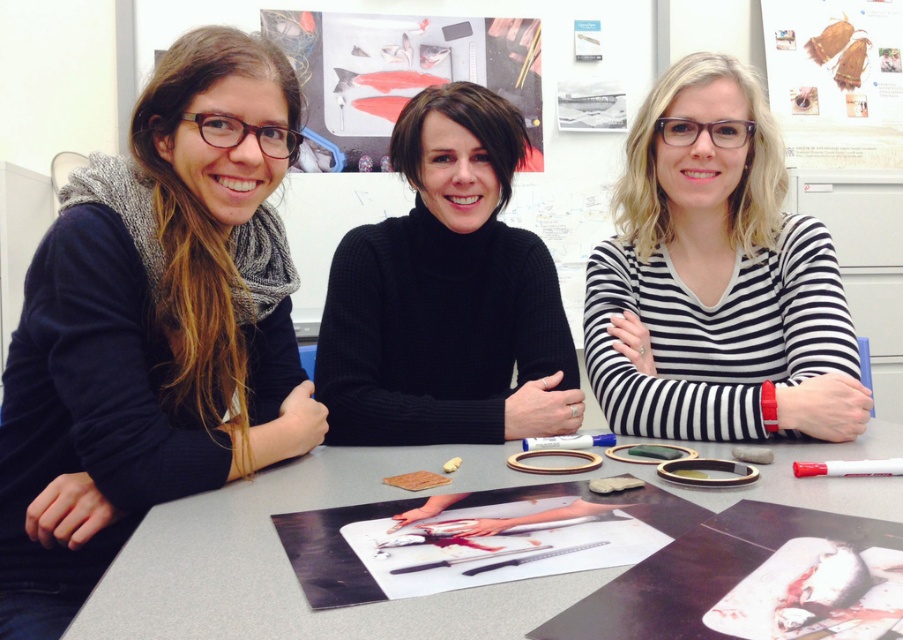
Question: Does matte black sweater at left have a smaller size compared to smooth gray table at center?

Choices:
 (A) no
 (B) yes

Answer: (A)

Question: Estimate the real-world distances between objects in this image. Which object is farther from the smooth gray table at center?

Choices:
 (A) black turtleneck sweater at center
 (B) matte black sweater at left

Answer: (A)

Question: Which point is farther to the camera?

Choices:
 (A) (808, 256)
 (B) (197, 467)

Answer: (A)

Question: Does black turtleneck sweater at center appear under smooth gray table at center?

Choices:
 (A) no
 (B) yes

Answer: (A)

Question: Among these points, which one is nearest to the camera?

Choices:
 (A) (666, 179)
 (B) (185, 362)
 (C) (855, 484)
 (D) (533, 308)

Answer: (C)

Question: Is black turtleneck sweater at center bigger than smooth gray table at center?

Choices:
 (A) yes
 (B) no

Answer: (A)